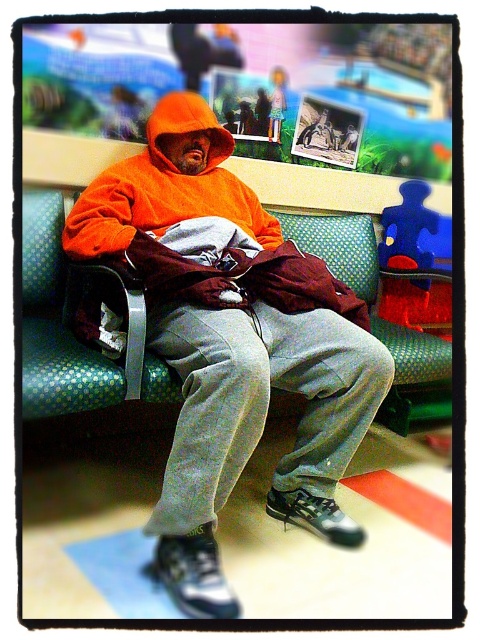
You are standing in the waiting area and notice two points marked on the wall behind the person. The first point is at coordinates point (192, 310) and the second is at point (406, 358). Which point is closer to you?

Point (192, 310) is closer to the camera than point (406, 358).

You are a photographer trying to capture a photo of the orange fleece hoodie at center and the green dotted fabric bench at center. Based on their sizes, which object should you focus on first if you want to include both in the frame without cropping?

The orange fleece hoodie at center is much taller than the green dotted fabric bench at center, so you should focus on the orange fleece hoodie at center first to ensure it fits properly in the frame.

Looking at this image, you are designing a new seating area and want to ensure the orange fleece hoodie at center and the green dotted fabric bench at center can both fit comfortably. Based on their sizes, which object should you prioritize placing first to maximize space efficiency?

The orange fleece hoodie at center is larger in size than the green dotted fabric bench at center, so you should prioritize placing the orange fleece hoodie at center first to ensure there is enough space for it before arranging the smaller bench.